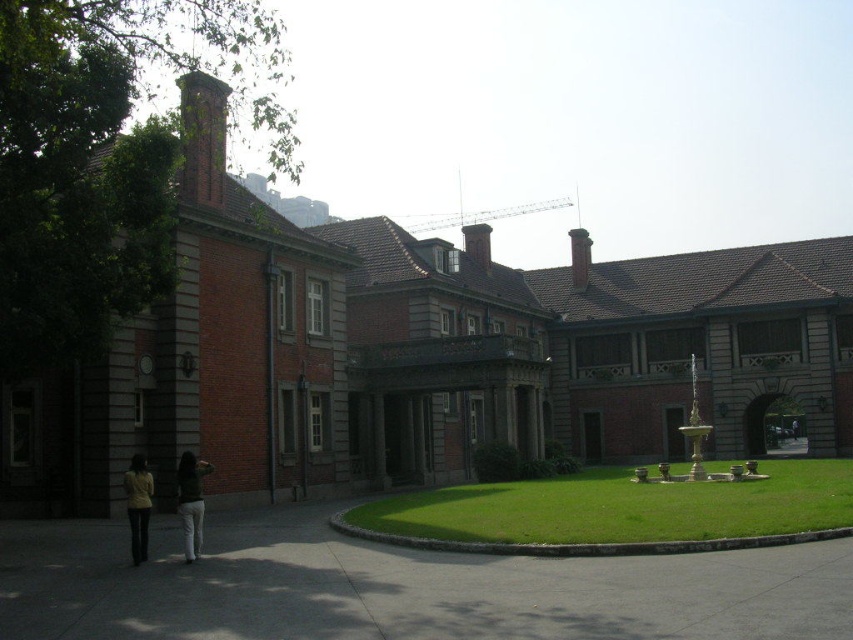
Question: Based on their relative distances, which object is nearer to the dark green sweater at center?

Choices:
 (A) green grass at center
 (B) yellow fabric jacket at lower left

Answer: (B)

Question: Does green grass at center appear under yellow fabric jacket at lower left?

Choices:
 (A) yes
 (B) no

Answer: (A)

Question: Among these points, which one is farthest from the camera?

Choices:
 (A) (189, 563)
 (B) (138, 486)
 (C) (763, 481)

Answer: (C)

Question: Which point is farther from the camera taking this photo?

Choices:
 (A) (184, 490)
 (B) (132, 476)
 (C) (692, 513)

Answer: (C)

Question: Can you confirm if dark green sweater at center is wider than yellow fabric jacket at lower left?

Choices:
 (A) yes
 (B) no

Answer: (B)

Question: Can you confirm if green grass at center is positioned above yellow fabric jacket at lower left?

Choices:
 (A) no
 (B) yes

Answer: (A)